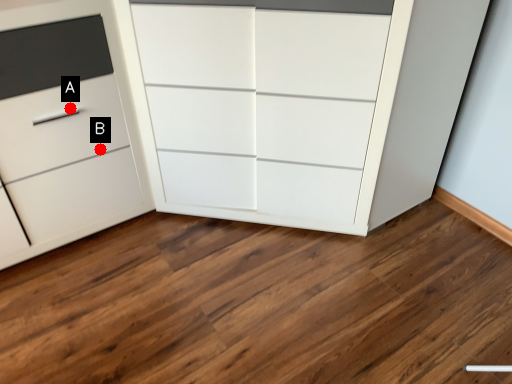
Question: Two points are circled on the image, labeled by A and B beside each circle. Which point appears farthest from the camera in this image?

Choices:
 (A) A is further
 (B) B is further

Answer: (B)